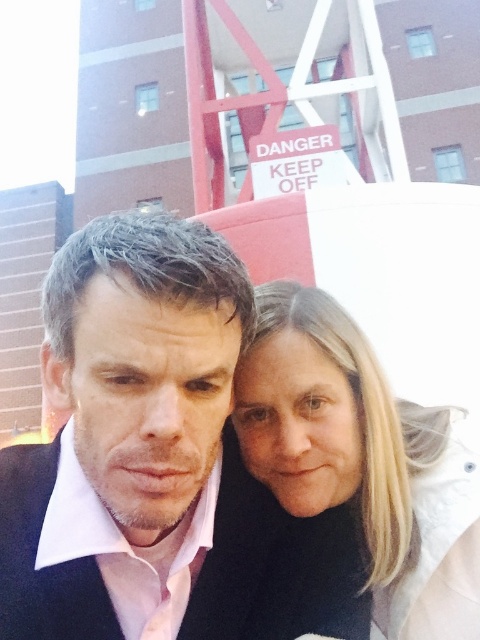
Is point (135, 564) positioned in front of point (415, 595)?

No, (135, 564) is behind (415, 595).

Looking at this image, is the position of black matte jacket at center more distant than that of blonde hair at center?

No.

I want to click on black matte jacket at center, so (157, 461).